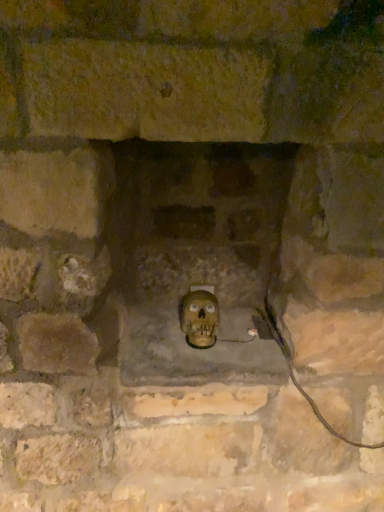
What is the approximate height of matte brown skull at center?

6.26 inches.

Identify the location of matte brown skull at center. (199, 318).

Describe the element at coordinates (199, 318) in the screenshot. I see `matte brown skull at center` at that location.

This screenshot has width=384, height=512. What are the coordinates of `matte brown skull at center` in the screenshot? It's located at (199, 318).